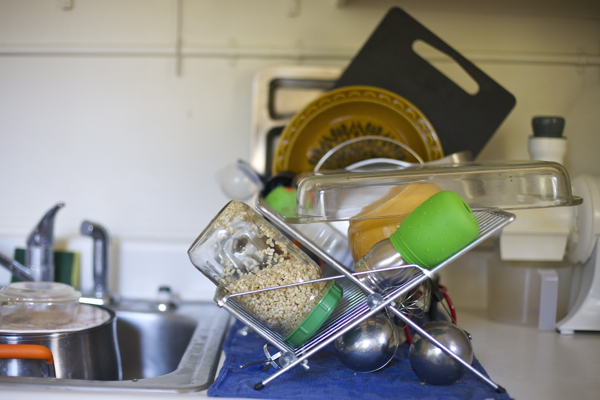
Where is `silver pot`? silver pot is located at coordinates (101, 355).